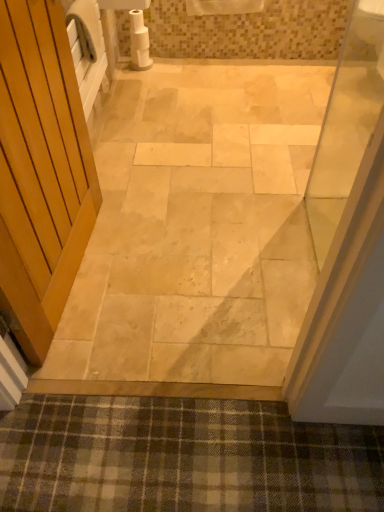
Question: From a real-world perspective, is plaid fabric bath mat at lower center below natural stone floor at center?

Choices:
 (A) yes
 (B) no

Answer: (B)

Question: Considering the relative sizes of plaid fabric bath mat at lower center and natural stone floor at center in the image provided, is plaid fabric bath mat at lower center wider than natural stone floor at center?

Choices:
 (A) no
 (B) yes

Answer: (A)

Question: Is plaid fabric bath mat at lower center shorter than natural stone floor at center?

Choices:
 (A) no
 (B) yes

Answer: (B)

Question: Considering the relative sizes of plaid fabric bath mat at lower center and natural stone floor at center in the image provided, is plaid fabric bath mat at lower center taller than natural stone floor at center?

Choices:
 (A) yes
 (B) no

Answer: (B)

Question: From the image's perspective, is plaid fabric bath mat at lower center located beneath natural stone floor at center?

Choices:
 (A) yes
 (B) no

Answer: (A)

Question: Is plaid fabric bath mat at lower center in front of or behind white matte toilet paper at upper center in the image?

Choices:
 (A) front
 (B) behind

Answer: (A)

Question: Is point (29, 463) positioned closer to the camera than point (134, 67)?

Choices:
 (A) farther
 (B) closer

Answer: (B)

Question: From the image's perspective, is plaid fabric bath mat at lower center above or below white matte toilet paper at upper center?

Choices:
 (A) above
 (B) below

Answer: (B)

Question: Is plaid fabric bath mat at lower center bigger or smaller than white matte toilet paper at upper center?

Choices:
 (A) big
 (B) small

Answer: (A)

Question: From a real-world perspective, relative to plaid fabric bath mat at lower center, is natural stone floor at center vertically above or below?

Choices:
 (A) above
 (B) below

Answer: (B)

Question: Which is correct: natural stone floor at center is inside plaid fabric bath mat at lower center, or outside of it?

Choices:
 (A) outside
 (B) inside

Answer: (A)

Question: Is natural stone floor at center wider or thinner than plaid fabric bath mat at lower center?

Choices:
 (A) wide
 (B) thin

Answer: (A)

Question: Considering the positions of natural stone floor at center and plaid fabric bath mat at lower center in the image, is natural stone floor at center bigger or smaller than plaid fabric bath mat at lower center?

Choices:
 (A) small
 (B) big

Answer: (B)

Question: Visually, is white matte toilet paper at upper center positioned to the left or to the right of natural stone floor at center?

Choices:
 (A) right
 (B) left

Answer: (B)

Question: Considering the positions of point (140, 18) and point (150, 287), is point (140, 18) closer or farther from the camera than point (150, 287)?

Choices:
 (A) farther
 (B) closer

Answer: (A)